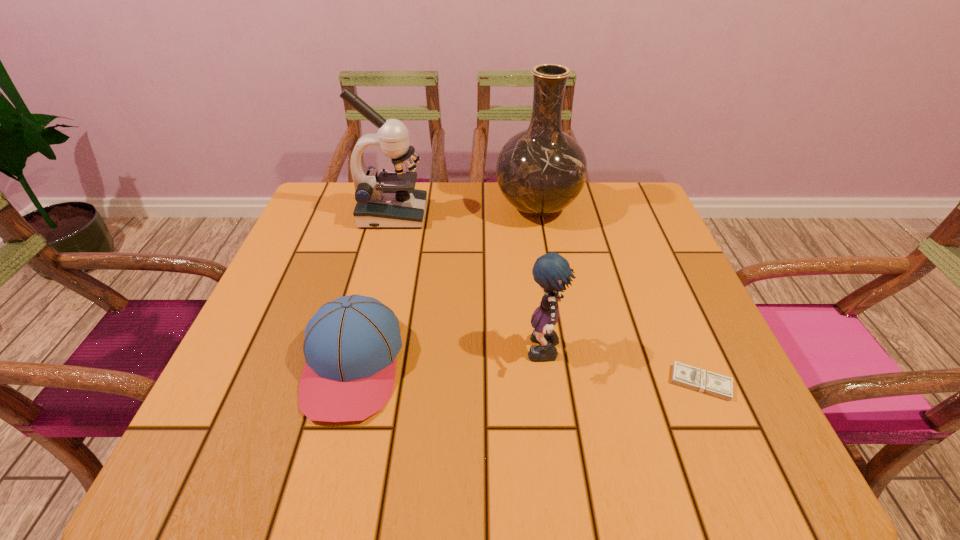
Find the location of `free space located on the front-facing side of the rag doll`. free space located on the front-facing side of the rag doll is located at coordinates (313, 354).

Where is `blank area located 0.170m on the left of the money`? This screenshot has width=960, height=540. blank area located 0.170m on the left of the money is located at coordinates (576, 382).

The height and width of the screenshot is (540, 960). Identify the location of vase positioned at the far edge. (541, 170).

The image size is (960, 540). I want to click on microscope that is at the far edge, so [x=389, y=200].

Locate an element on the screen. The image size is (960, 540). object situated at the near edge is located at coordinates (350, 346).

Locate an element on the screen. microscope situated at the left edge is located at coordinates (389, 200).

You are a GUI agent. You are given a task and a screenshot of the screen. Output one action in this format:
    pyautogui.click(x=<x>, y=<y>)
    Task: Click on the baseball cap that is positioned at the left edge
    The width and height of the screenshot is (960, 540).
    Given the screenshot: What is the action you would take?
    pyautogui.click(x=350, y=346)

The image size is (960, 540). I want to click on object present at the right edge, so click(684, 375).

Find the location of a particular element. object that is at the far left corner is located at coordinates (389, 200).

Find the location of `object at the near left corner`. object at the near left corner is located at coordinates (350, 346).